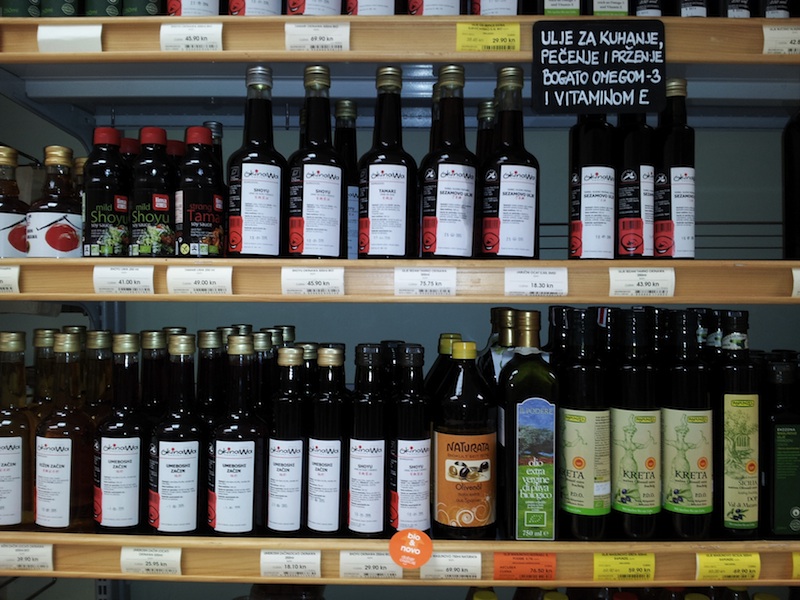
Find the location of `metal shelf bracket`. metal shelf bracket is located at coordinates (101, 592), (94, 324), (56, 112).